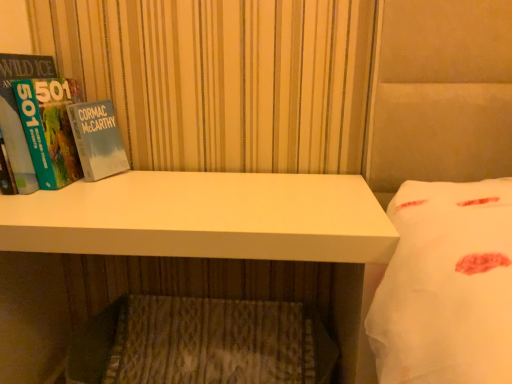
Question: Considering the relative sizes of wooden textured mattress at lower center and hardcover book at left in the image provided, is wooden textured mattress at lower center bigger than hardcover book at left?

Choices:
 (A) yes
 (B) no

Answer: (A)

Question: Is hardcover book at left a part of wooden textured mattress at lower center?

Choices:
 (A) yes
 (B) no

Answer: (B)

Question: Can you confirm if wooden textured mattress at lower center is thinner than hardcover book at left?

Choices:
 (A) yes
 (B) no

Answer: (B)

Question: From the image's perspective, is wooden textured mattress at lower center on hardcover book at left?

Choices:
 (A) yes
 (B) no

Answer: (B)

Question: Does wooden textured mattress at lower center have a greater width compared to hardcover book at left?

Choices:
 (A) no
 (B) yes

Answer: (B)

Question: Is wooden textured mattress at lower center turned away from hardcover book at left?

Choices:
 (A) yes
 (B) no

Answer: (B)

Question: Is white matte desk at center outside hardcover book at left?

Choices:
 (A) no
 (B) yes

Answer: (B)

Question: Considering the relative sizes of white matte desk at center and hardcover book at left in the image provided, is white matte desk at center bigger than hardcover book at left?

Choices:
 (A) yes
 (B) no

Answer: (A)

Question: Can you confirm if white matte desk at center is wider than hardcover book at left?

Choices:
 (A) yes
 (B) no

Answer: (A)

Question: Is hardcover book at left at the back of white matte desk at center?

Choices:
 (A) yes
 (B) no

Answer: (B)

Question: Is white matte desk at center positioned far away from hardcover book at left?

Choices:
 (A) no
 (B) yes

Answer: (A)

Question: Can you confirm if white matte desk at center is smaller than hardcover book at left?

Choices:
 (A) yes
 (B) no

Answer: (B)

Question: Could white matte desk at center be considered to be inside hardcover book at left?

Choices:
 (A) no
 (B) yes

Answer: (A)